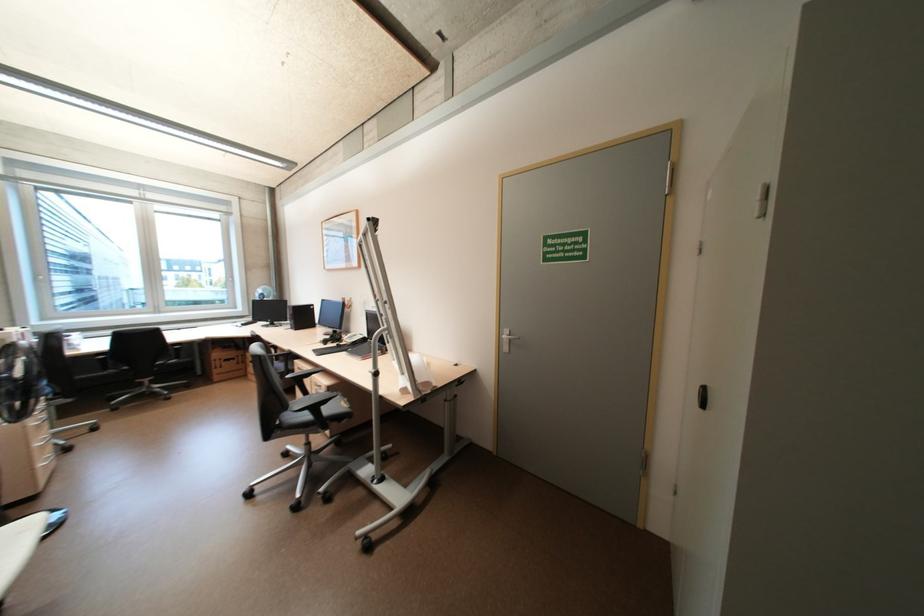
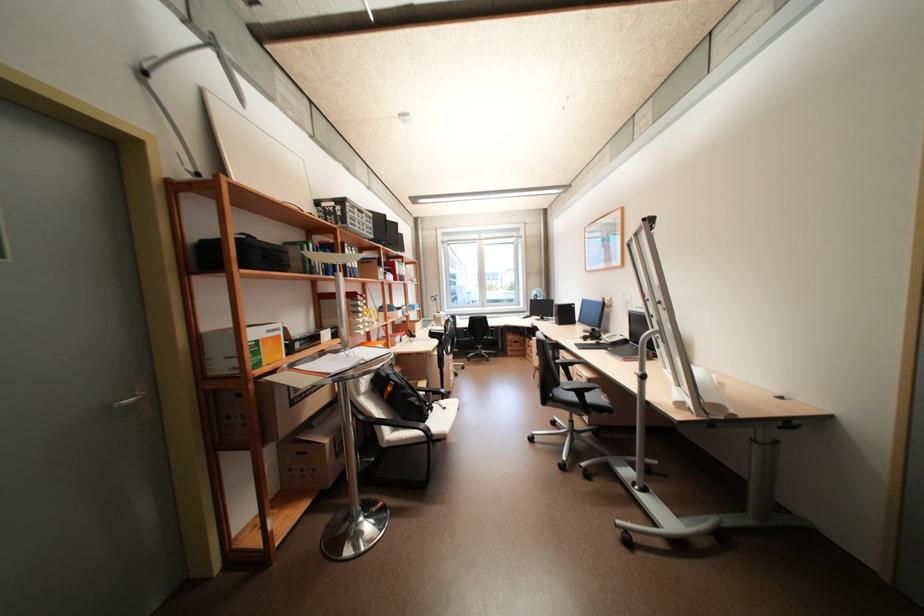
Find the pixel in the second image that matches (x=313, y=375) in the first image.

(578, 363)